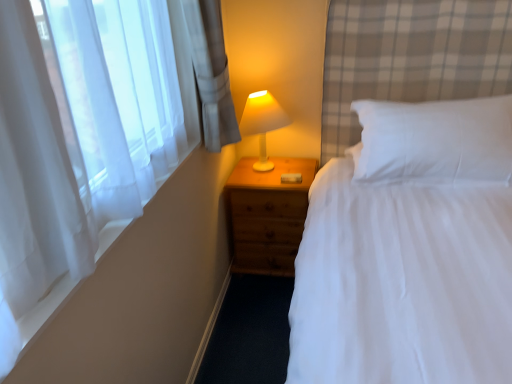
Describe the element at coordinates (435, 140) in the screenshot. This screenshot has height=384, width=512. I see `white soft pillow at upper right` at that location.

Find the location of a particular element. This screenshot has height=384, width=512. sheer white curtain at left is located at coordinates (144, 290).

From a real-world perspective, which is physically above, white soft pillow at upper right or white plastic lamp at upper right?

white soft pillow at upper right.

In terms of width, does white soft pillow at upper right look wider or thinner when compared to white plastic lamp at upper right?

In the image, white soft pillow at upper right appears to be wider than white plastic lamp at upper right.

Is white soft pillow at upper right beside white plastic lamp at upper right?

white soft pillow at upper right is not next to white plastic lamp at upper right, and they're not touching.

Between point (454, 177) and point (263, 116), which one is positioned behind?

The point (263, 116) is behind.

Can you tell me how much white plastic lamp at upper right and wooden nightstand at center differ in facing direction?

0.349 degrees.

Can you confirm if white plastic lamp at upper right is positioned to the right of wooden nightstand at center?

Incorrect, white plastic lamp at upper right is not on the right side of wooden nightstand at center.

Is white plastic lamp at upper right oriented towards wooden nightstand at center?

No, white plastic lamp at upper right is not facing towards wooden nightstand at center.

Who is bigger, white plastic lamp at upper right or wooden nightstand at center?

With larger size is wooden nightstand at center.

From the image's perspective, between wooden nightstand at center and white soft pillow at upper right, who is located below?

wooden nightstand at center appears lower in the image.

Does point (243, 168) come behind point (470, 131)?

Yes, it is.

Identify the location of nightstand on the left of the white soft pillow at upper right. (268, 214).

Considering the positions of objects wooden nightstand at center and white soft pillow at upper right in the image provided, who is more to the left, wooden nightstand at center or white soft pillow at upper right?

wooden nightstand at center is more to the left.

You are a GUI agent. You are given a task and a screenshot of the screen. Output one action in this format:
    pyautogui.click(x=<x>, y=<y>)
    Task: Click on the pillow beneath the sheer white curtain at left (from a real-world perspective)
    This screenshot has height=384, width=512.
    Given the screenshot: What is the action you would take?
    pyautogui.click(x=435, y=140)

Is point (420, 124) farther from camera compared to point (114, 313)?

That is True.

How different are the orientations of white soft pillow at upper right and sheer white curtain at left in degrees?

There is a 92-degree angle between the facing directions of white soft pillow at upper right and sheer white curtain at left.

Looking at this image, is sheer white curtain at left completely or partially outside of wooden nightstand at center?

Indeed, sheer white curtain at left is completely outside wooden nightstand at center.

Is wooden nightstand at center at the back of sheer white curtain at left?

sheer white curtain at left is not turned away from wooden nightstand at center.

Can you confirm if sheer white curtain at left is shorter than wooden nightstand at center?

Correct, sheer white curtain at left is not as tall as wooden nightstand at center.

Does sheer white curtain at left have a smaller size compared to white soft pillow at upper right?

Correct, sheer white curtain at left occupies less space than white soft pillow at upper right.

What's the angular difference between sheer white curtain at left and white soft pillow at upper right's facing directions?

There is a 92-degree angle between the facing directions of sheer white curtain at left and white soft pillow at upper right.

Would you say sheer white curtain at left is a long distance from white soft pillow at upper right?

sheer white curtain at left is near white soft pillow at upper right, not far away.

Between sheer white curtain at left and white soft pillow at upper right, which one is positioned behind?

white soft pillow at upper right is further away from the camera.

From a real-world perspective, is white plastic lamp at upper right beneath sheer white curtain at left?

Yes, from a real-world perspective, white plastic lamp at upper right is beneath sheer white curtain at left.

Are white plastic lamp at upper right and sheer white curtain at left located far from each other?

Actually, white plastic lamp at upper right and sheer white curtain at left are a little close together.

At what (x,y) coordinates should I click in order to perform the action: click on lamp that is under the sheer white curtain at left (from a real-world perspective). Please return your answer as a coordinate pair (x, y). This screenshot has height=384, width=512. Looking at the image, I should click on (262, 123).

You are a GUI agent. You are given a task and a screenshot of the screen. Output one action in this format:
    pyautogui.click(x=<x>, y=<y>)
    Task: Click on the pillow above the white plastic lamp at upper right (from a real-world perspective)
    
    Given the screenshot: What is the action you would take?
    pyautogui.click(x=435, y=140)

I want to click on lamp that appears on the left of wooden nightstand at center, so click(x=262, y=123).

When comparing their distances from white plastic lamp at upper right, does wooden nightstand at center or white soft pillow at upper right seem further?

Based on the image, white soft pillow at upper right appears to be further to white plastic lamp at upper right.

From the image, which object appears to be farther from wooden nightstand at center, white soft pillow at upper right or sheer white curtain at left?

Among the two, white soft pillow at upper right is located further to wooden nightstand at center.

When comparing their distances from sheer white curtain at left, does wooden nightstand at center or white plastic lamp at upper right seem closer?

wooden nightstand at center is positioned closer to the anchor sheer white curtain at left.

Estimate the real-world distances between objects in this image. Which object is further from white soft pillow at upper right, white plastic lamp at upper right or wooden nightstand at center?

Based on the image, white plastic lamp at upper right appears to be further to white soft pillow at upper right.

When comparing their distances from white plastic lamp at upper right, does white soft pillow at upper right or wooden nightstand at center seem closer?

The object closer to white plastic lamp at upper right is wooden nightstand at center.

Which object lies further to the anchor point sheer white curtain at left, white plastic lamp at upper right or white soft pillow at upper right?

white soft pillow at upper right is further to sheer white curtain at left.

When comparing their distances from sheer white curtain at left, does wooden nightstand at center or white soft pillow at upper right seem further?

white soft pillow at upper right lies further to sheer white curtain at left than the other object.

Considering their positions, is white soft pillow at upper right positioned further to wooden nightstand at center than white plastic lamp at upper right?

white soft pillow at upper right.

This screenshot has height=384, width=512. I want to click on nightstand situated between white plastic lamp at upper right and white soft pillow at upper right from left to right, so click(268, 214).

At what (x,y) coordinates should I click in order to perform the action: click on pillow located between sheer white curtain at left and wooden nightstand at center in the depth direction. Please return your answer as a coordinate pair (x, y). The image size is (512, 384). Looking at the image, I should click on (435, 140).

Locate an element on the screen. The width and height of the screenshot is (512, 384). lamp positioned between sheer white curtain at left and wooden nightstand at center from near to far is located at coordinates (262, 123).

The image size is (512, 384). Identify the location of pillow located between sheer white curtain at left and white plastic lamp at upper right in the depth direction. (435, 140).